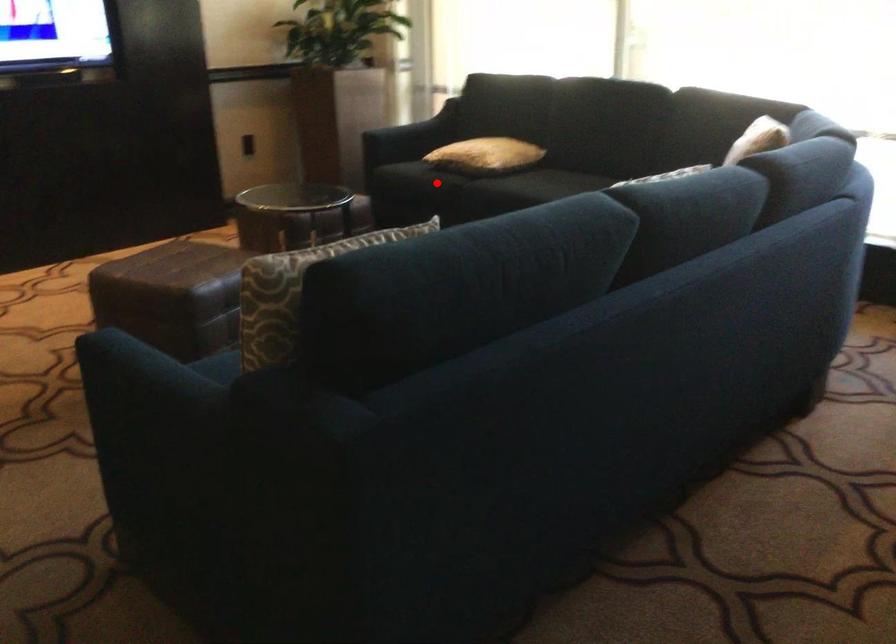
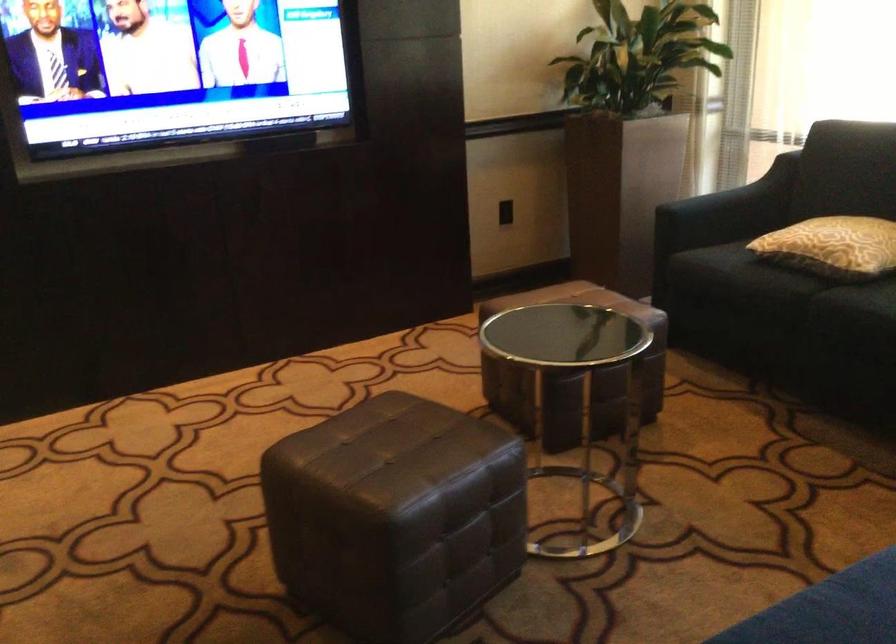
Question: I am providing you with two images of the same scene from different viewpoints. In image1, a red point is highlighted. Considering the same 3D point in image2, which of the following is correct?

Choices:
 (A) It is closer
 (B) It is farther

Answer: (A)